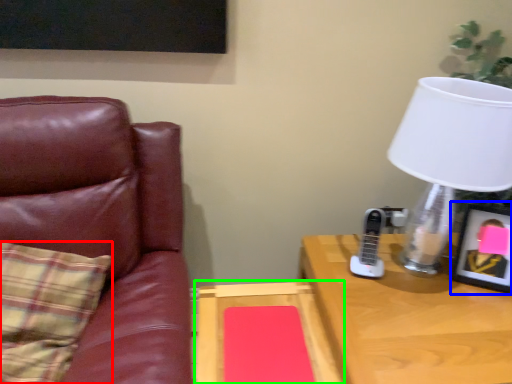
Question: Considering the real-world distances, which object is farthest from pillow (highlighted by a red box)? picture frame (highlighted by a blue box) or table (highlighted by a green box)?

Choices:
 (A) picture frame
 (B) table

Answer: (A)